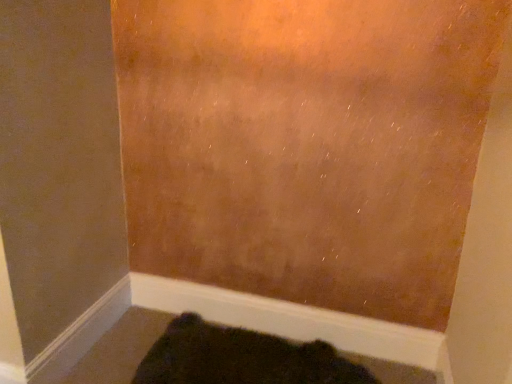
Question: Is white smooth baseboard at lower center taller than dark fuzzy rug at lower center?

Choices:
 (A) no
 (B) yes

Answer: (B)

Question: Considering the relative positions of white smooth baseboard at lower center and dark fuzzy rug at lower center in the image provided, is white smooth baseboard at lower center behind dark fuzzy rug at lower center?

Choices:
 (A) yes
 (B) no

Answer: (A)

Question: Does white smooth baseboard at lower center touch dark fuzzy rug at lower center?

Choices:
 (A) yes
 (B) no

Answer: (B)

Question: Is the depth of white smooth baseboard at lower center less than that of dark fuzzy rug at lower center?

Choices:
 (A) yes
 (B) no

Answer: (B)

Question: Does white smooth baseboard at lower center have a greater width compared to dark fuzzy rug at lower center?

Choices:
 (A) no
 (B) yes

Answer: (A)

Question: Does white smooth baseboard at lower center turn towards dark fuzzy rug at lower center?

Choices:
 (A) no
 (B) yes

Answer: (B)

Question: Can you confirm if dark fuzzy rug at lower center is shorter than white smooth baseboard at lower center?

Choices:
 (A) yes
 (B) no

Answer: (A)

Question: Is dark fuzzy rug at lower center positioned with its back to white smooth baseboard at lower center?

Choices:
 (A) no
 (B) yes

Answer: (B)

Question: Can you confirm if dark fuzzy rug at lower center is bigger than white smooth baseboard at lower center?

Choices:
 (A) yes
 (B) no

Answer: (A)

Question: Does dark fuzzy rug at lower center have a greater height compared to white smooth baseboard at lower center?

Choices:
 (A) no
 (B) yes

Answer: (A)

Question: Would you say dark fuzzy rug at lower center contains white smooth baseboard at lower center?

Choices:
 (A) yes
 (B) no

Answer: (B)

Question: From the image's perspective, does dark fuzzy rug at lower center appear higher than white smooth baseboard at lower center?

Choices:
 (A) yes
 (B) no

Answer: (B)

Question: Based on their positions, is dark fuzzy rug at lower center located to the left or right of white smooth baseboard at lower center?

Choices:
 (A) right
 (B) left

Answer: (B)